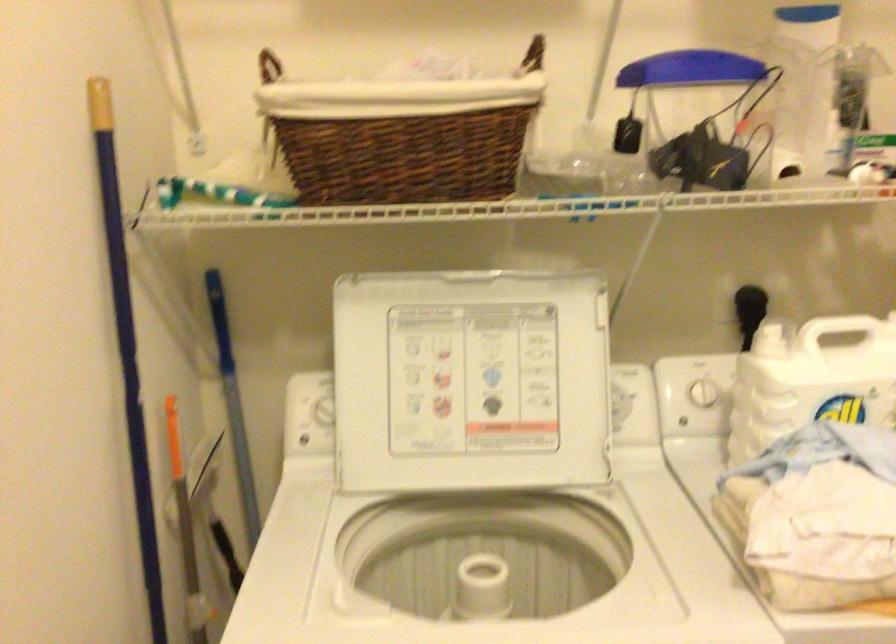
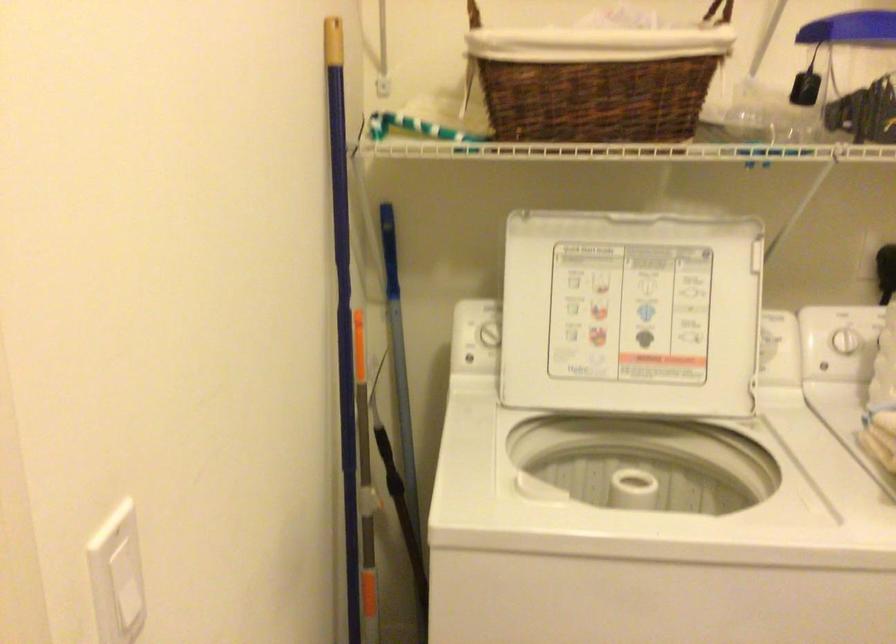
Locate, in the second image, the point that corresponds to point (323, 412) in the first image.

(488, 334)